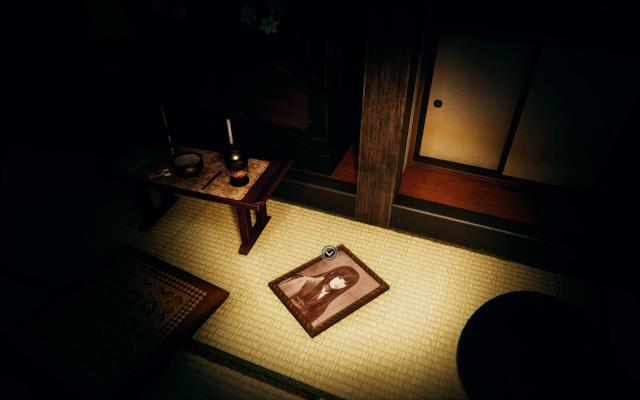
The width and height of the screenshot is (640, 400). In order to click on candle jar in this screenshot , I will do `click(239, 162)`.